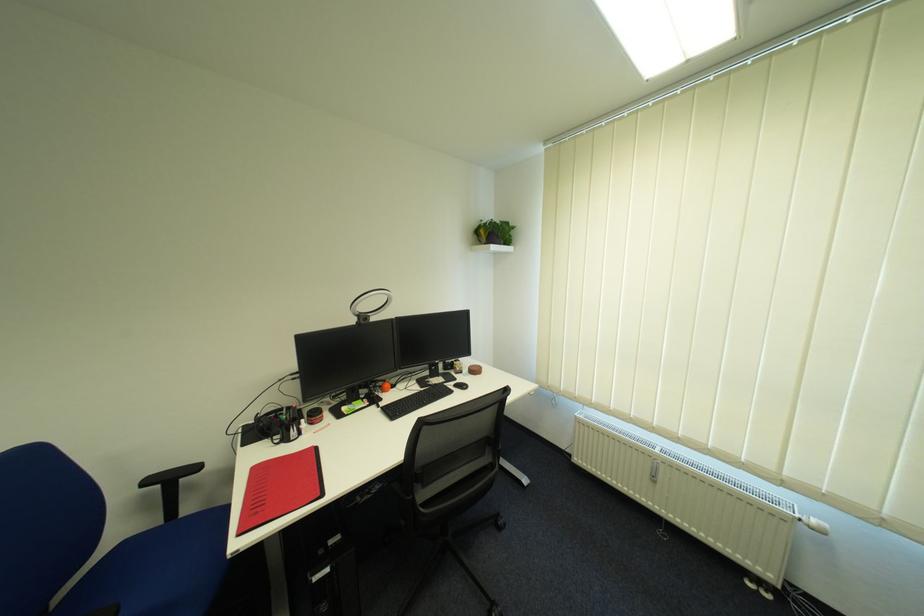
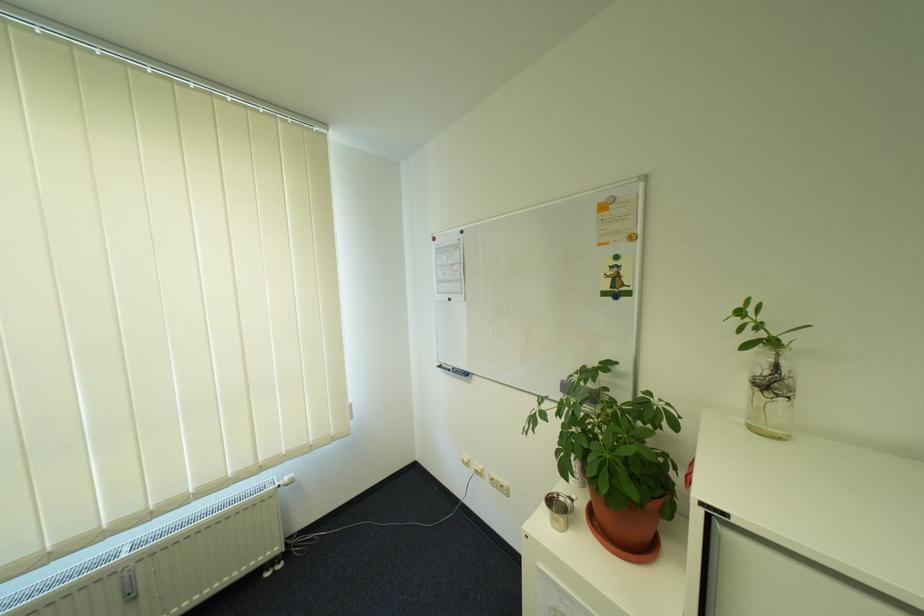
Question: Based on the continuous images, in which direction is the camera rotating? Reply with the corresponding letter.

Choices:
 (A) Left
 (B) Right
 (C) Up
 (D) Down

Answer: (B)